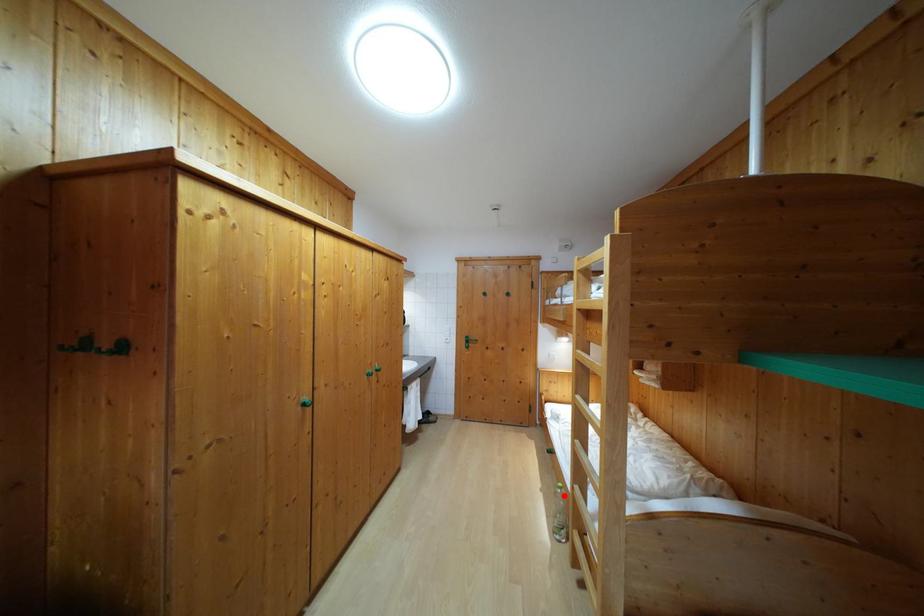
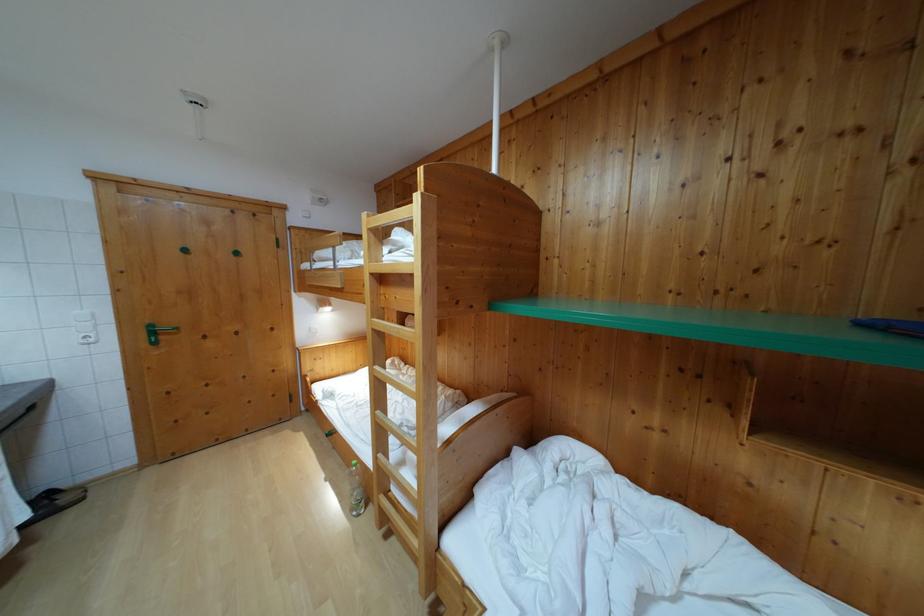
Where in the second image is the point corresponding to the highlighted location from the first image?

(359, 472)